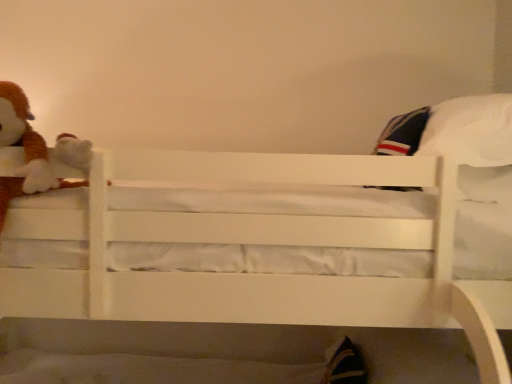
I want to click on brown plush toy at left, so click(x=34, y=153).

This screenshot has width=512, height=384. What do you see at coordinates (34, 153) in the screenshot?
I see `brown plush toy at left` at bounding box center [34, 153].

Locate an element on the screen. brown plush toy at left is located at coordinates (34, 153).